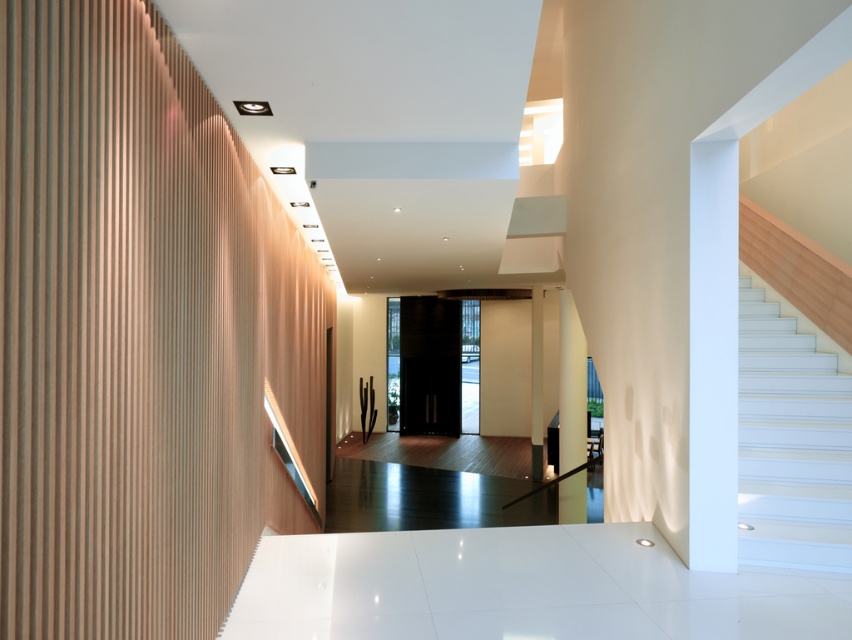
Question: Which object is farther from the camera taking this photo?

Choices:
 (A) white glossy pillar at center
 (B) white glossy stairs at right

Answer: (A)

Question: Is white glossy stairs at right wider than white glossy pillar at center?

Choices:
 (A) yes
 (B) no

Answer: (A)

Question: Does white glossy stairs at right appear on the left side of white glossy pillar at center?

Choices:
 (A) no
 (B) yes

Answer: (A)

Question: Which point is closer to the camera taking this photo?

Choices:
 (A) (778, 541)
 (B) (565, 413)

Answer: (A)

Question: Can you confirm if white glossy stairs at right is positioned below white glossy pillar at center?

Choices:
 (A) yes
 (B) no

Answer: (B)

Question: Which point appears farthest from the camera in this image?

Choices:
 (A) 836,540
 (B) 574,458

Answer: (B)